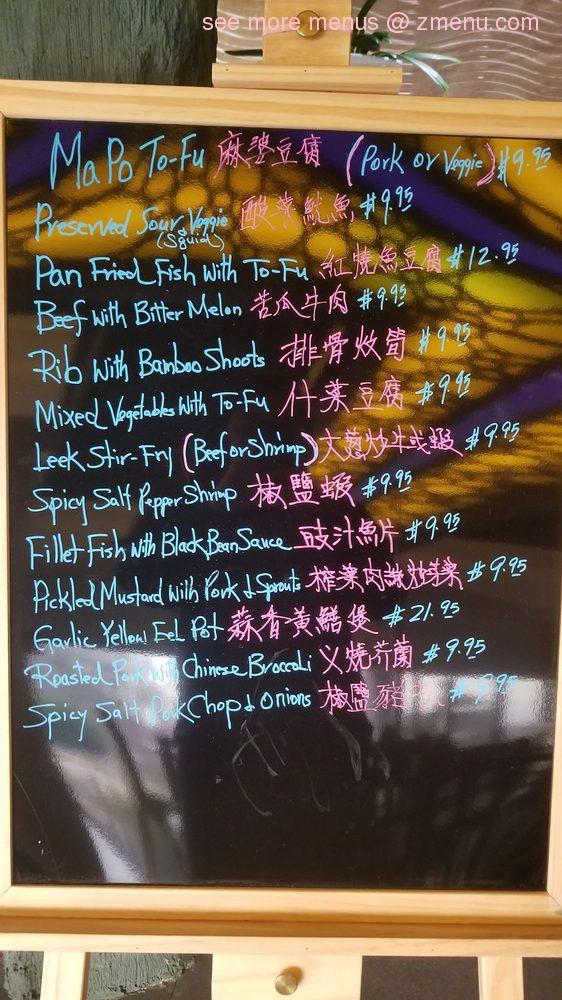
This screenshot has height=1000, width=562. What are the coordinates of `wall` in the screenshot? It's located at (117, 38).